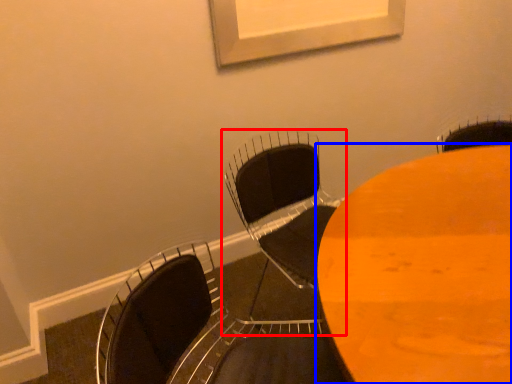
Question: Which point is closer to the camera, chair (highlighted by a red box) or table (highlighted by a blue box)?

Choices:
 (A) chair
 (B) table

Answer: (B)